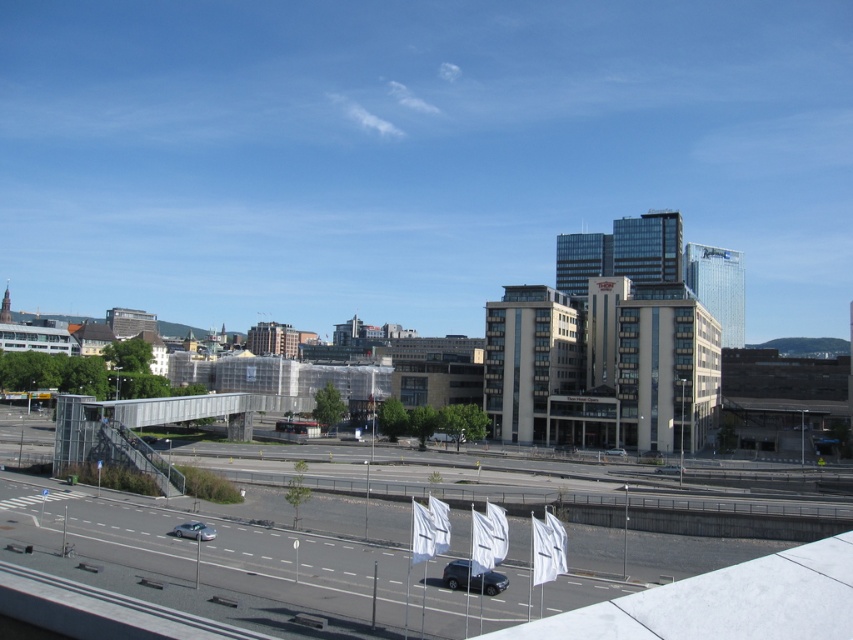
You are a delivery truck driver who needs to pass through the space between the metallic gray overpass at center and another structure. Your truck is the same width as the matte black suv at center. Can you safely navigate through the space without hitting the overpass?

The metallic gray overpass at center is wider than the matte black suv at center, so yes, the truck can safely pass through the space as the overpass is wider than the truck.

You are a delivery drone with a wingspan of 1.2 meters. You need to fly from the white fabric flags at lower center to the satin silver car at lower left. Is there enough space between them for your flight path?

The distance between the white fabric flags at lower center and the satin silver car at lower left is 14.42 meters. Since your wingspan is only 1.2 meters, there is ample space for your flight path between them.